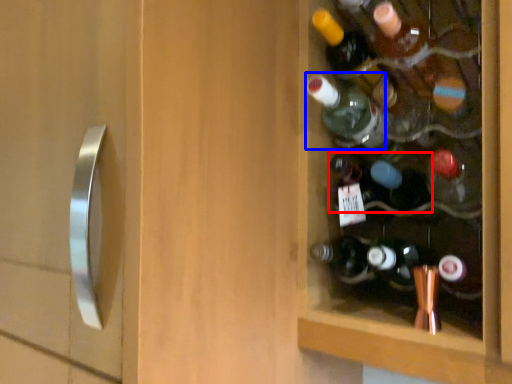
Question: Which object appears farthest to the camera in this image, bottle (highlighted by a red box) or bottle (highlighted by a blue box)?

Choices:
 (A) bottle
 (B) bottle

Answer: (B)